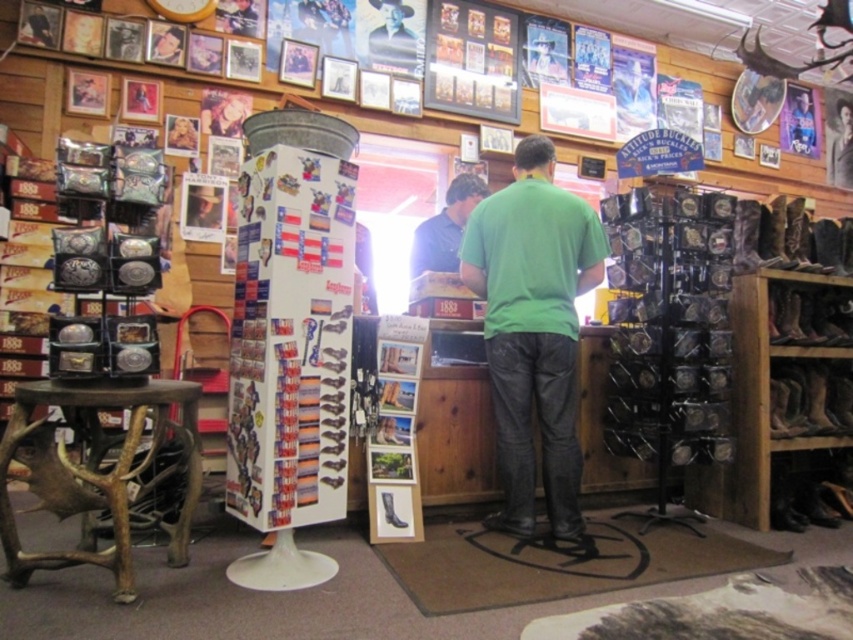
Question: Based on their relative distances, which object is farther from the green matte shirt at center?

Choices:
 (A) matte blue shirt at center
 (B) brown wooden stool at lower left

Answer: (B)

Question: Can you confirm if brown wooden stool at lower left is wider than matte blue shirt at center?

Choices:
 (A) no
 (B) yes

Answer: (B)

Question: Which of these objects is positioned farthest from the brown wooden stool at lower left?

Choices:
 (A) rugged leather cowboy hat at upper center
 (B) matte blue shirt at center

Answer: (A)

Question: Does brown wooden stool at lower left appear over rugged leather cowboy hat at upper center?

Choices:
 (A) no
 (B) yes

Answer: (A)

Question: Does green matte shirt at center have a larger size compared to brown wooden stool at lower left?

Choices:
 (A) no
 (B) yes

Answer: (B)

Question: Which point is farther to the camera?

Choices:
 (A) (469, 205)
 (B) (44, 445)
 (C) (403, 29)

Answer: (C)